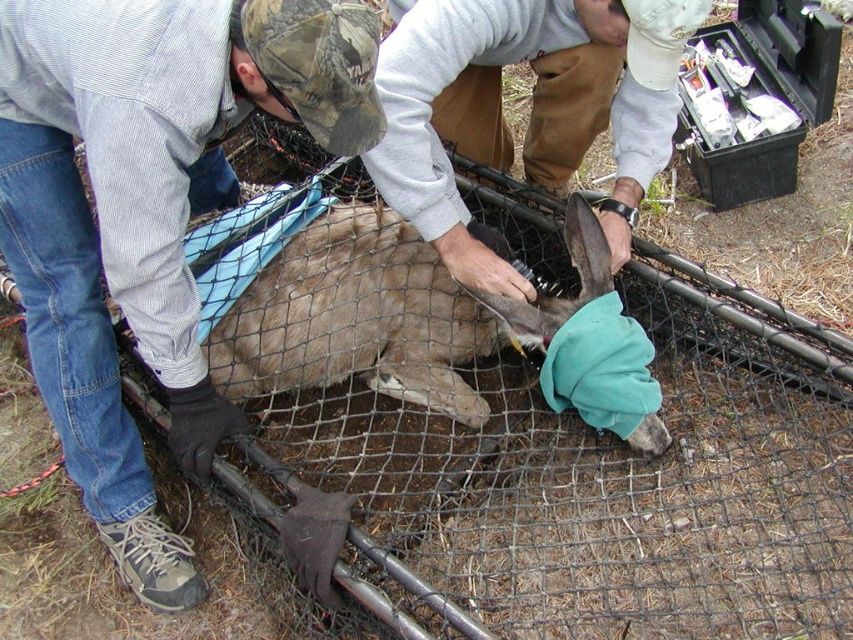
Question: Which object appears closest to the camera in this image?

Choices:
 (A) camouflage hat at upper left
 (B) brown leather glove at center

Answer: (A)

Question: Is brown leather glove at center above brown fur at center?

Choices:
 (A) no
 (B) yes

Answer: (B)

Question: Does camouflage hat at upper left appear on the right side of brown leather glove at center?

Choices:
 (A) yes
 (B) no

Answer: (B)

Question: Is brown leather glove at center positioned before brown fur at center?

Choices:
 (A) no
 (B) yes

Answer: (B)

Question: Which of the following is the closest to the observer?

Choices:
 (A) brown leather glove at center
 (B) brown fur at center
 (C) camouflage hat at upper left

Answer: (C)

Question: Which of the following is the closest to the observer?

Choices:
 (A) (38, 282)
 (B) (397, 221)

Answer: (A)